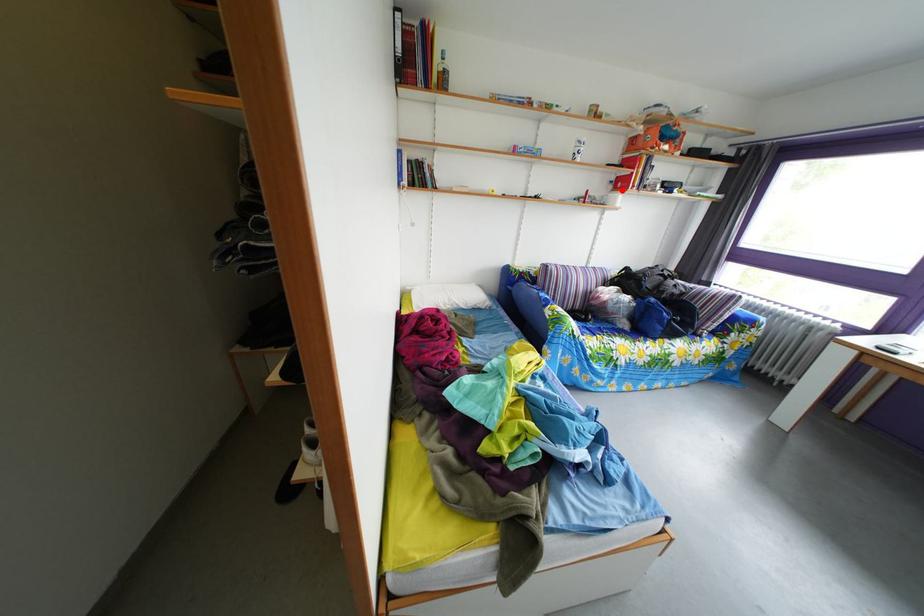
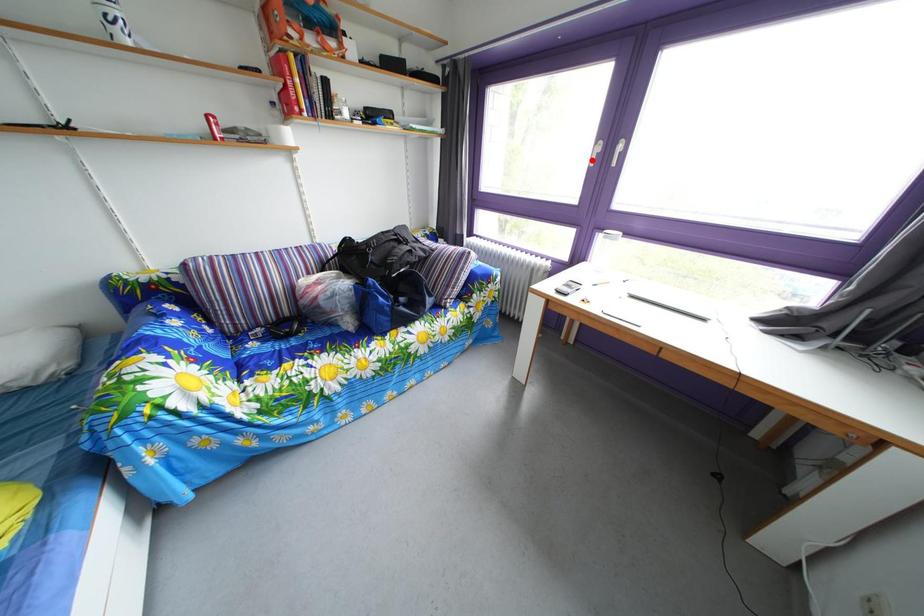
I am providing you with two images of the same scene from different viewpoints. A red point is marked on the first image and another point is marked on the second image. Do the highlighted points in image1 and image2 indicate the same real-world spot?

No